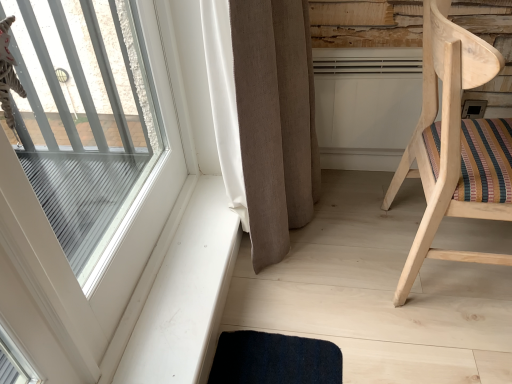
Question: Can you confirm if clear glass window at upper left is thinner than beige fabric curtain at center?

Choices:
 (A) yes
 (B) no

Answer: (A)

Question: Is there a large distance between clear glass window at upper left and beige fabric curtain at center?

Choices:
 (A) yes
 (B) no

Answer: (B)

Question: Is clear glass window at upper left oriented away from beige fabric curtain at center?

Choices:
 (A) no
 (B) yes

Answer: (A)

Question: Considering the relative sizes of clear glass window at upper left and beige fabric curtain at center in the image provided, is clear glass window at upper left smaller than beige fabric curtain at center?

Choices:
 (A) yes
 (B) no

Answer: (A)

Question: Can we say clear glass window at upper left lies outside beige fabric curtain at center?

Choices:
 (A) no
 (B) yes

Answer: (B)

Question: From their relative heights in the image, would you say clear glass window at upper left is taller or shorter than white smooth window sill at lower left?

Choices:
 (A) tall
 (B) short

Answer: (A)

Question: In terms of size, does clear glass window at upper left appear bigger or smaller than white smooth window sill at lower left?

Choices:
 (A) small
 (B) big

Answer: (B)

Question: Would you say clear glass window at upper left is to the left or to the right of white smooth window sill at lower left in the picture?

Choices:
 (A) left
 (B) right

Answer: (A)

Question: In terms of width, does clear glass window at upper left look wider or thinner when compared to white smooth window sill at lower left?

Choices:
 (A) thin
 (B) wide

Answer: (A)

Question: Does point (70, 271) appear closer or farther from the camera than point (475, 125)?

Choices:
 (A) farther
 (B) closer

Answer: (B)

Question: From a real-world perspective, is clear glass window at upper left above or below natural wood chair at right?

Choices:
 (A) above
 (B) below

Answer: (A)

Question: In the image, is clear glass window at upper left positioned in front of or behind natural wood chair at right?

Choices:
 (A) behind
 (B) front

Answer: (B)

Question: Looking at their shapes, would you say clear glass window at upper left is wider or thinner than natural wood chair at right?

Choices:
 (A) wide
 (B) thin

Answer: (B)

Question: Is natural wood chair at right in front of or behind white smooth window sill at lower left in the image?

Choices:
 (A) front
 (B) behind

Answer: (A)

Question: From a real-world perspective, relative to white smooth window sill at lower left, is natural wood chair at right vertically above or below?

Choices:
 (A) below
 (B) above

Answer: (B)